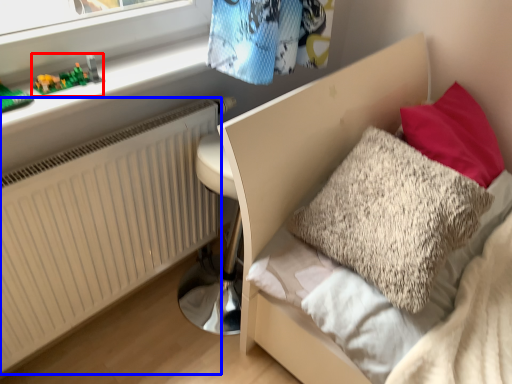
Question: Which object appears farthest to the camera in this image, toy (highlighted by a red box) or radiator (highlighted by a blue box)?

Choices:
 (A) toy
 (B) radiator

Answer: (A)